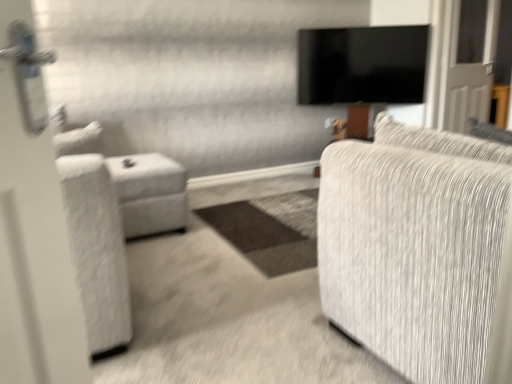
Question: Is white fabric ottoman at left looking in the opposite direction of black glossy tv at upper center?

Choices:
 (A) yes
 (B) no

Answer: (B)

Question: Is white fabric ottoman at left outside of black glossy tv at upper center?

Choices:
 (A) yes
 (B) no

Answer: (A)

Question: From the image's perspective, is white fabric ottoman at left above black glossy tv at upper center?

Choices:
 (A) yes
 (B) no

Answer: (B)

Question: Can you confirm if white fabric ottoman at left is bigger than black glossy tv at upper center?

Choices:
 (A) no
 (B) yes

Answer: (B)

Question: Is white fabric ottoman at left to the right of black glossy tv at upper center from the viewer's perspective?

Choices:
 (A) no
 (B) yes

Answer: (A)

Question: Is black glossy tv at upper center surrounded by white fabric ottoman at left?

Choices:
 (A) no
 (B) yes

Answer: (A)

Question: From the image's perspective, is white fabric ottoman at left located above textured gray fabric couch at right?

Choices:
 (A) yes
 (B) no

Answer: (A)

Question: Considering the relative positions of white fabric ottoman at left and textured gray fabric couch at right in the image provided, is white fabric ottoman at left in front of textured gray fabric couch at right?

Choices:
 (A) no
 (B) yes

Answer: (A)

Question: From a real-world perspective, is white fabric ottoman at left on textured gray fabric couch at right?

Choices:
 (A) no
 (B) yes

Answer: (A)

Question: Considering the relative positions of white fabric ottoman at left and textured gray fabric couch at right in the image provided, is white fabric ottoman at left behind textured gray fabric couch at right?

Choices:
 (A) yes
 (B) no

Answer: (A)

Question: Does white fabric ottoman at left have a greater width compared to textured gray fabric couch at right?

Choices:
 (A) yes
 (B) no

Answer: (B)

Question: From a real-world perspective, is white fabric ottoman at left below textured gray fabric couch at right?

Choices:
 (A) yes
 (B) no

Answer: (A)

Question: Does black glossy tv at upper center have a greater height compared to white fabric ottoman at left?

Choices:
 (A) no
 (B) yes

Answer: (B)